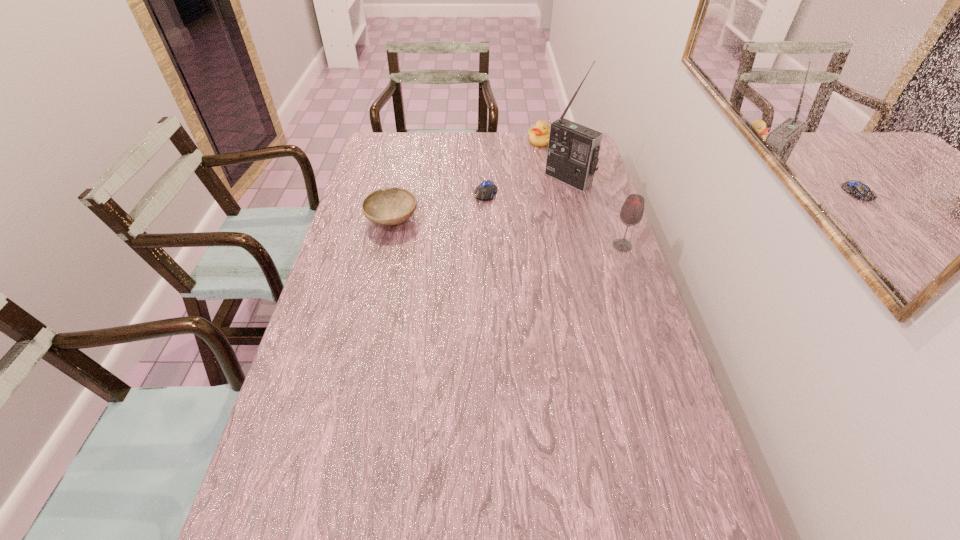
The height and width of the screenshot is (540, 960). Find the location of `free space that satisfies the following two spatial constraints: 1. on the back side of the duckling; 2. on the left side of the bowl`. free space that satisfies the following two spatial constraints: 1. on the back side of the duckling; 2. on the left side of the bowl is located at coordinates (409, 141).